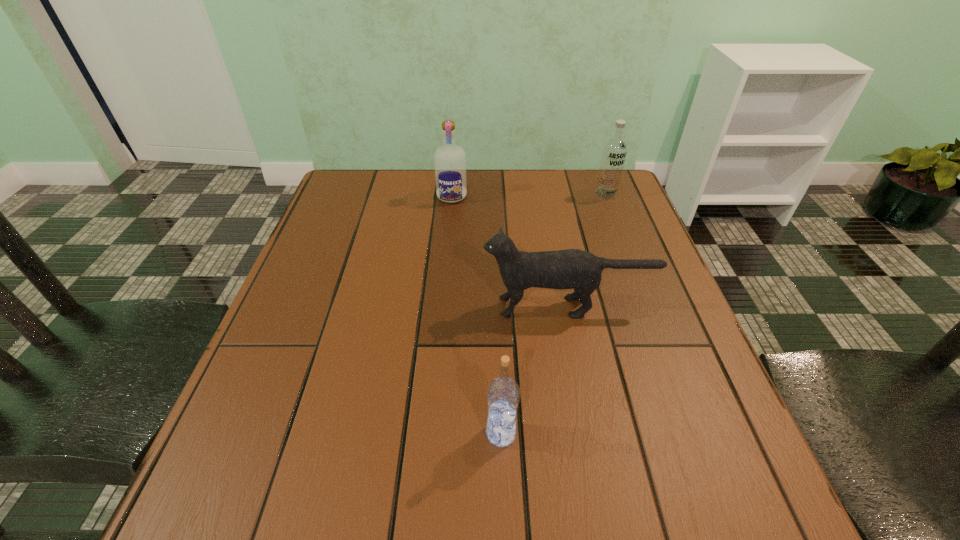
Identify the location of vacant space located on the front-facing side of the second nearest object. The image size is (960, 540). (323, 307).

I want to click on vodka that is at the right edge, so click(614, 151).

Identify the location of cat that is at the right edge. The height and width of the screenshot is (540, 960). (576, 269).

Where is `object at the far right corner`? The image size is (960, 540). object at the far right corner is located at coordinates (614, 151).

Identify the location of vacant space at the far edge of the desktop. The height and width of the screenshot is (540, 960). (553, 180).

This screenshot has width=960, height=540. What are the coordinates of `free space at the near edge of the desktop` in the screenshot? It's located at (485, 470).

Identify the location of vacant space at the left edge. (337, 328).

In the image, there is a desktop. At what (x,y) coordinates should I click in order to perform the action: click on vacant space at the right edge. Please return your answer as a coordinate pair (x, y). This screenshot has width=960, height=540. Looking at the image, I should click on (687, 458).

Where is `vacant region at the far left corner of the desktop`? The width and height of the screenshot is (960, 540). vacant region at the far left corner of the desktop is located at coordinates (337, 194).

The height and width of the screenshot is (540, 960). What are the coordinates of `free area in between the rightmost vodka and the second nearest object` in the screenshot? It's located at (587, 250).